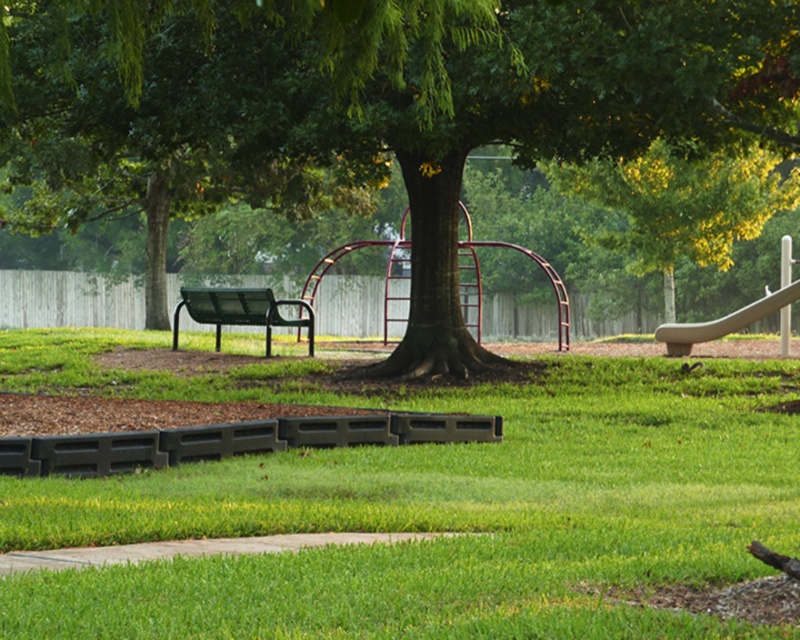
You are a parent trying to decide where to place a new picnic blanket in the park. You want to ensure that the area you choose is shaded by the green textured tree at center but still close to the smooth gray slide at right. Based on their heights, can you determine if the tree will provide enough shade over the slide area?

The green textured tree at center is much taller than the smooth gray slide at right, so it will likely cast sufficient shade over the slide area.

You are planning to place a picnic blanket in the park. The picnic blanket is 2 meters wide. You see the green textured tree at center and the smooth gray slide at right. Which object has enough space to place the blanket next to it without overlapping?

The green textured tree at center has a larger width than the smooth gray slide at right according to the description. Since the picnic blanket is 2 meters wide, the tree likely provides more space to place the blanket next to it without overlapping.

You are standing at the bottom left corner of the park and want to walk directly towards the green textured tree at center. Which direction should you head?

To reach the green textured tree at center from the bottom left corner, you should head towards the center of the image, as the tree is located at point coordinates 0.163 on the x and 0.470 on the y axis.